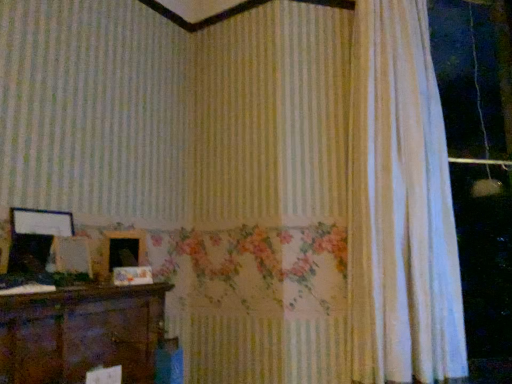
Question: From a real-world perspective, is wooden picture frame at center, positioned as the 2th picture frame in left-to-right order, positioned above or below wooden picture frame at left, which appears as the 2th picture frame when viewed from the right?

Choices:
 (A) above
 (B) below

Answer: (B)

Question: From their relative heights in the image, would you say wooden picture frame at center, the 1th picture frame from the right, is taller or shorter than wooden picture frame at left, which appears as the 2th picture frame when viewed from the right?

Choices:
 (A) short
 (B) tall

Answer: (A)

Question: Estimate the real-world distances between objects in this image. Which object is closer to the wooden picture frame at left, which appears as the 2th picture frame when viewed from the right?

Choices:
 (A) white sheer curtain at right
 (B) wooden picture frame at center, the 1th picture frame from the right

Answer: (B)

Question: Estimate the real-world distances between objects in this image. Which object is closer to the white sheer curtain at right?

Choices:
 (A) wooden picture frame at left, acting as the 1th picture frame starting from the left
 (B) wooden picture frame at center, the 1th picture frame from the right

Answer: (B)